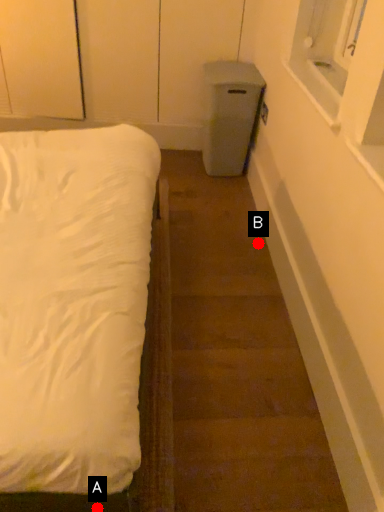
Question: Two points are circled on the image, labeled by A and B beside each circle. Which of the following is the closest to the observer?

Choices:
 (A) A is closer
 (B) B is closer

Answer: (A)